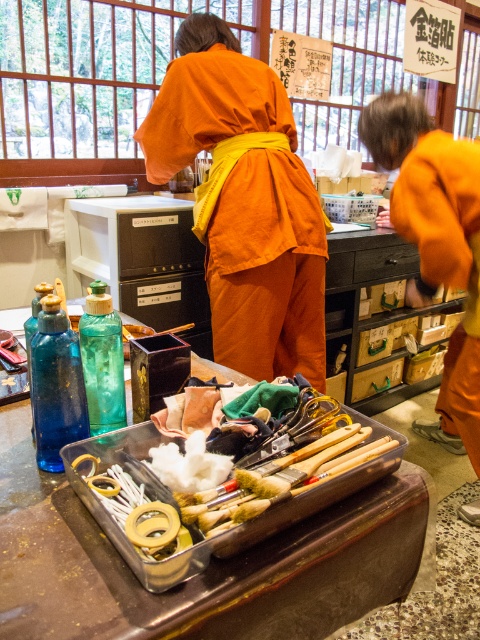
Can you confirm if clear plastic tray at center is bigger than orange cotton robe at right?

Actually, clear plastic tray at center might be smaller than orange cotton robe at right.

Who is more distant from viewer, (268, 547) or (405, 204)?

The point (405, 204) is behind.

The width and height of the screenshot is (480, 640). Identify the location of clear plastic tray at center. (204, 570).

Who is more forward, (257,572) or (60,333)?

Point (257,572) is more forward.

Image resolution: width=480 pixels, height=640 pixels. I want to click on clear plastic tray at center, so click(204, 570).

Can you confirm if orange cotton robe at right is shorter than translucent green glass bottle at center?

Incorrect, orange cotton robe at right's height does not fall short of translucent green glass bottle at center's.

Which is below, orange cotton robe at right or translucent green glass bottle at center?

Positioned lower is translucent green glass bottle at center.

What are the coordinates of `orange cotton robe at right` in the screenshot? It's located at (447, 260).